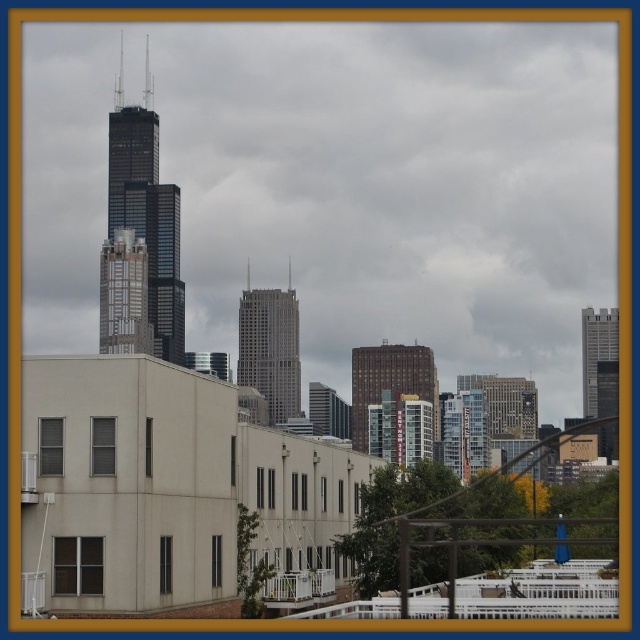
You are standing at the origin point of the city map. The black glass skyscraper at center is located at coordinates 0.372 in the x and 0.219 in the y. If you want to reach it, which direction should you move from your current position?

The black glass skyscraper at center is located at coordinates 0.372 in the x and 0.219 in the y, so you should move towards the center of the city to reach it.